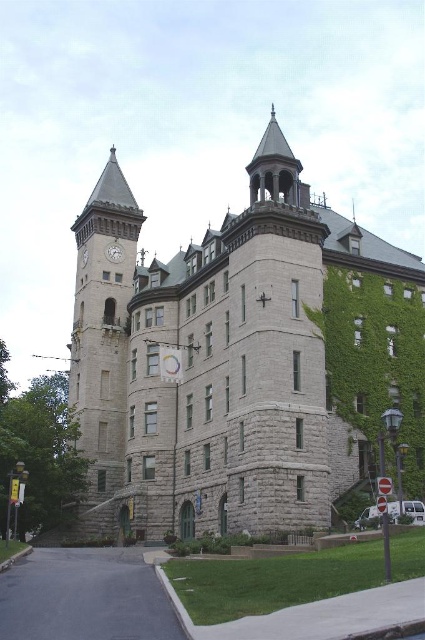
You are standing in front of the historic stone building and want to take a photo. You notice two points marked on the building at coordinates point (108, 422) and point (121, 244). Which point is closer to your camera position?

Point (108, 422) is closer to the camera than point (121, 244).

You are an architect planning to install a new decorative element on the building. You have two options for placement locations. One is on the gray stone clock tower at left, and the other is on the silver metallic clock at upper left. Which location offers more horizontal space for your design?

The gray stone clock tower at left has a larger width than the silver metallic clock at upper left, so the gray stone clock tower at left offers more horizontal space for the decorative element.